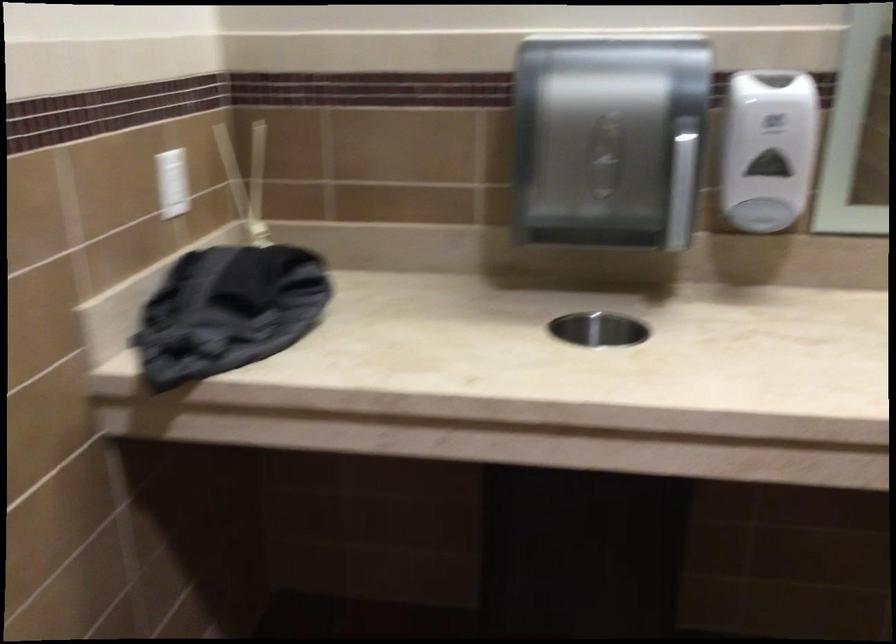
Identify the location of white light switch. (171, 183).